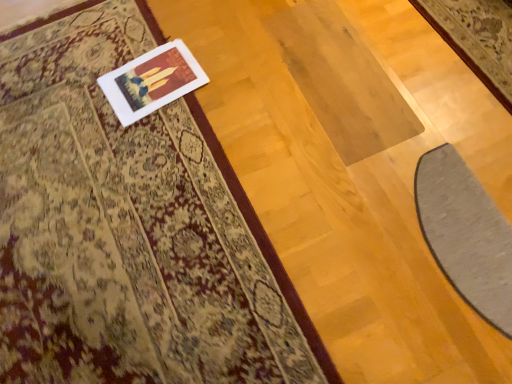
Locate an element on the screen. vacant space in silky beige rug at upper left (from a real-world perspective) is located at coordinates (118, 231).